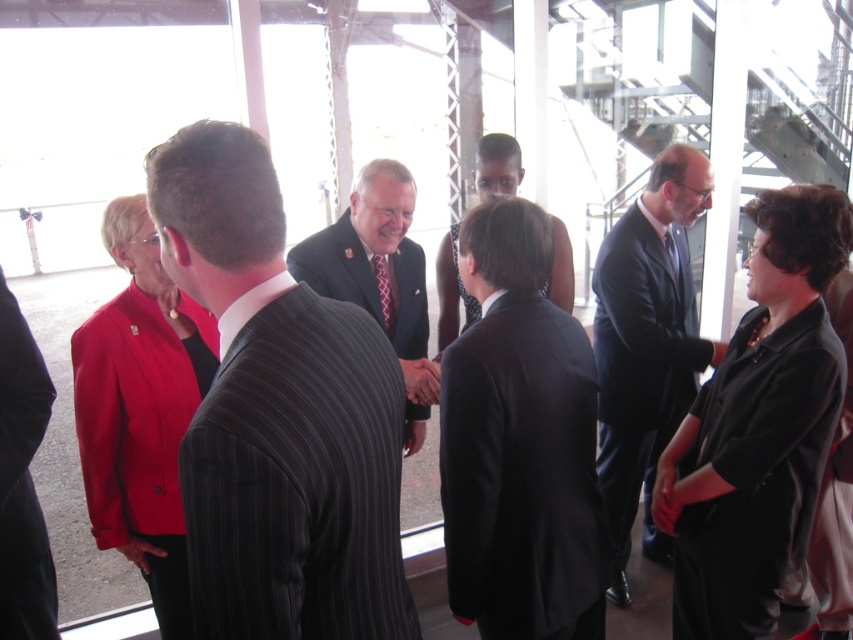
You are a photographer at this event and need to capture a clear photo of both the dark pinstripe suit at center and the black satin blouse at center. Since the camera can only focus on one subject at a time, which one should you focus on to ensure the other is still somewhat in focus?

You should focus on the dark pinstripe suit at center because it is in front of the black satin blouse at center. By focusing on the closer subject, the background subject will still be somewhat in focus due to depth of field.

You are a photographer setting up for a group photo. You need to ensure that the matte red blazer at left and the black pinstripe suit at left are at least 20 centimeters apart for proper framing. Based on the scene, can you confirm if they meet this requirement?

The distance between the matte red blazer at left and the black pinstripe suit at left is 21.10 centimeters, which exceeds the required 20 centimeters. Therefore, they meet the requirement for proper framing.